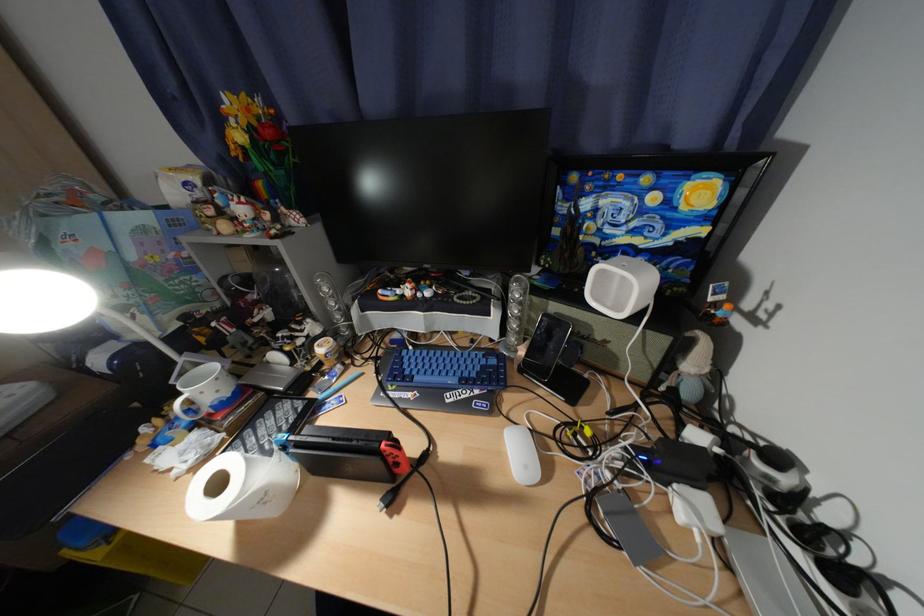
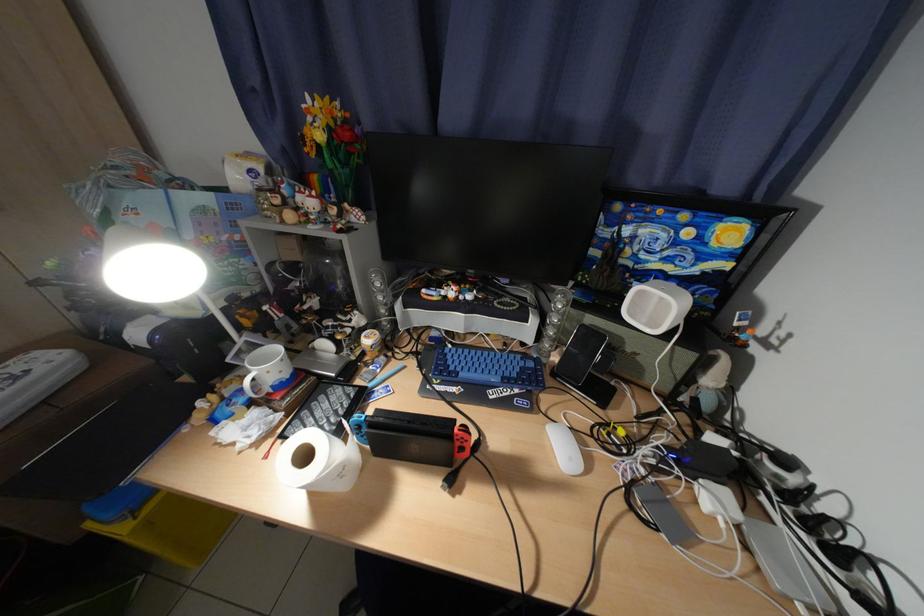
The point at (191, 395) is marked in the first image. Where is the corresponding point in the second image?

(260, 374)